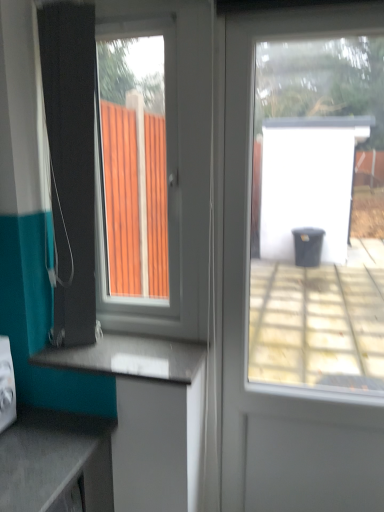
Where is `vacant area on top of transparent glass door at center (from a real-world perspective)`? The height and width of the screenshot is (512, 384). vacant area on top of transparent glass door at center (from a real-world perspective) is located at coordinates (309, 5).